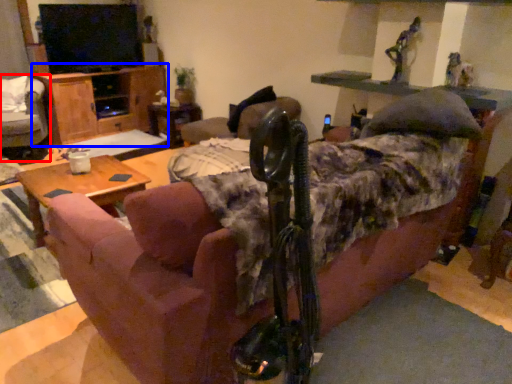
Question: Which of the following is the farthest to the observer, chair (highlighted by a red box) or dresser (highlighted by a blue box)?

Choices:
 (A) chair
 (B) dresser

Answer: (B)